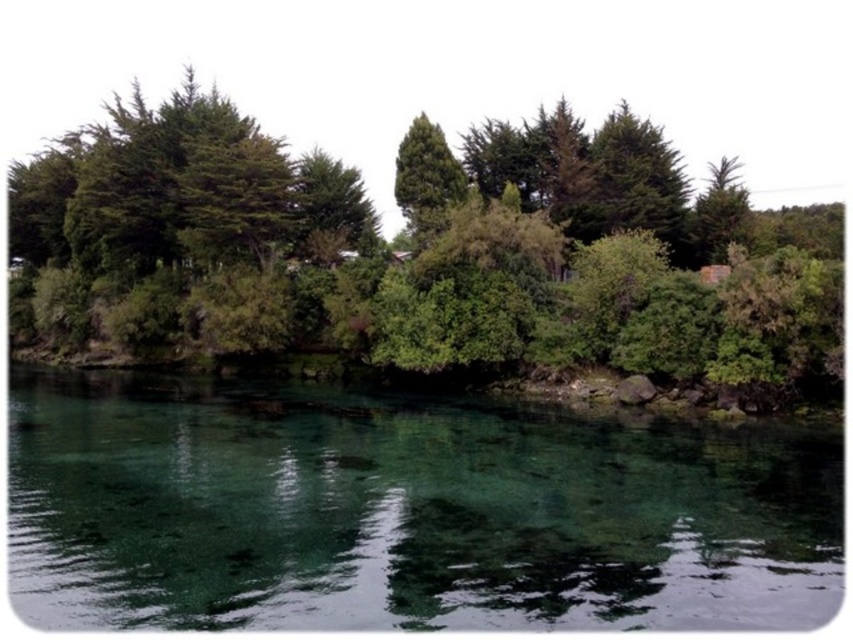
Can you confirm if clear glass water at center is shorter than green leafy trees at center?

Indeed, clear glass water at center has a lesser height compared to green leafy trees at center.

Can you confirm if clear glass water at center is wider than green leafy trees at center?

In fact, clear glass water at center might be narrower than green leafy trees at center.

Is point (834, 476) positioned before point (817, 356)?

Yes, it is.

The height and width of the screenshot is (640, 853). In order to click on clear glass water at center in this screenshot , I will do `click(403, 513)`.

In the scene shown: Does clear glass water at center have a lesser width compared to green leafy tree at center?

In fact, clear glass water at center might be wider than green leafy tree at center.

I want to click on clear glass water at center, so click(x=403, y=513).

Does point (271, 502) come farther from viewer compared to point (440, 192)?

No, (271, 502) is in front of (440, 192).

At what (x,y) coordinates should I click in order to perform the action: click on clear glass water at center. Please return your answer as a coordinate pair (x, y). The image size is (853, 640). Looking at the image, I should click on (403, 513).

Is the position of green leafy trees at center more distant than that of green leafy tree at center?

No.

Identify the location of green leafy trees at center. Image resolution: width=853 pixels, height=640 pixels. (422, 253).

Between point (659, 176) and point (437, 193), which one is positioned in front?

Point (437, 193) is more forward.

In order to click on green leafy trees at center in this screenshot , I will do `click(422, 253)`.